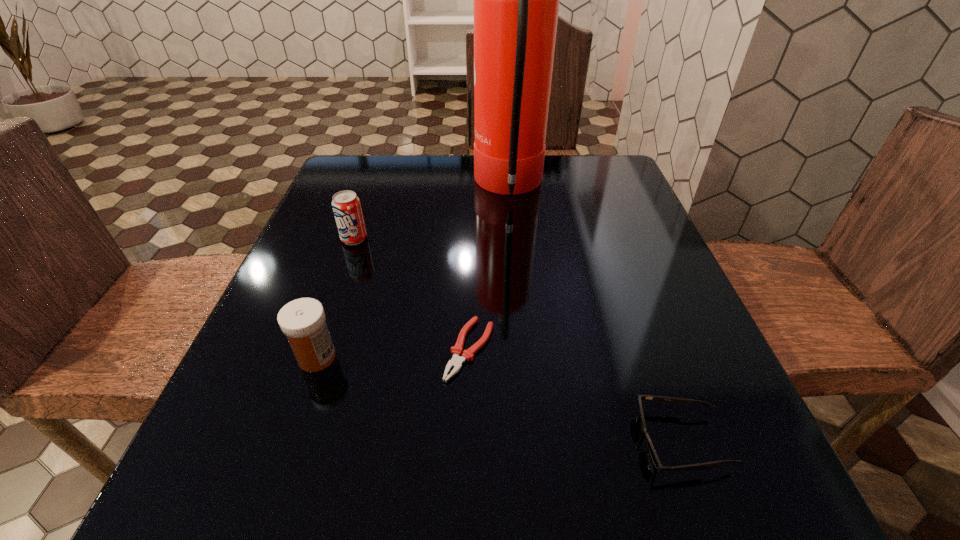
The image size is (960, 540). What are the coordinates of `free space located 0.090m on the back of the soda can` in the screenshot? It's located at (365, 208).

At what (x,y) coordinates should I click in order to perform the action: click on vacant area situated on the right of the medicine. Please return your answer as a coordinate pair (x, y). Looking at the image, I should click on (557, 357).

The height and width of the screenshot is (540, 960). What are the coordinates of `vacant position located 0.400m on the front-facing side of the sunglasses` in the screenshot? It's located at (345, 441).

Where is `vacant space situated 0.060m on the front-facing side of the sunglasses`? The image size is (960, 540). vacant space situated 0.060m on the front-facing side of the sunglasses is located at coordinates (595, 441).

In order to click on free space located 0.200m on the front-facing side of the sunglasses in this screenshot , I will do `click(492, 441)`.

This screenshot has width=960, height=540. What are the coordinates of `free region located 0.350m on the back of the pliers` in the screenshot? It's located at (472, 208).

This screenshot has width=960, height=540. In order to click on object that is at the far edge in this screenshot , I will do `click(516, 0)`.

Locate an element on the screen. object at the near edge is located at coordinates (678, 401).

At what (x,y) coordinates should I click in order to perform the action: click on soda can located in the left edge section of the desktop. Please return your answer as a coordinate pair (x, y). Looking at the image, I should click on (346, 205).

This screenshot has width=960, height=540. In order to click on medicine present at the left edge in this screenshot , I will do `click(302, 320)`.